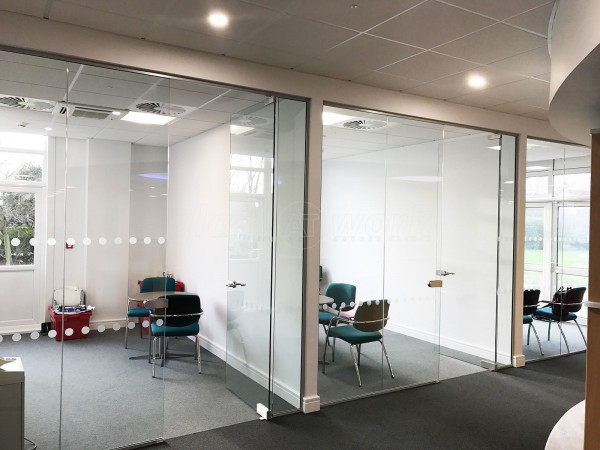
Find the location of a particular element. This screenshot has height=450, width=600. glass door is located at coordinates (255, 262), (423, 259).